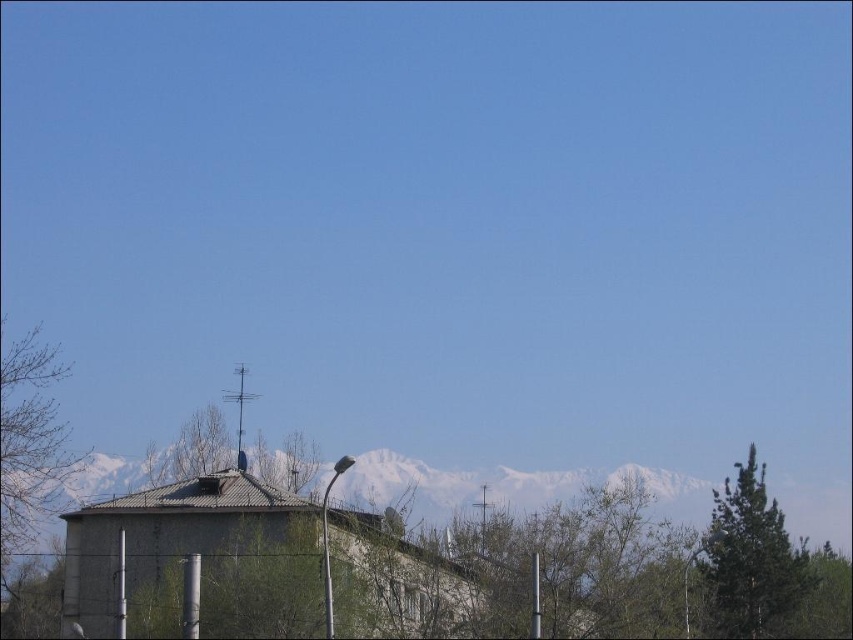
You are standing in the landscape and want to walk from the green textured tree at right to the bare branches at left. Which direction should you move relative to the trees?

Since the green textured tree at right is closer to you than the bare branches at left, you should move towards the left to reach the bare branches at left.